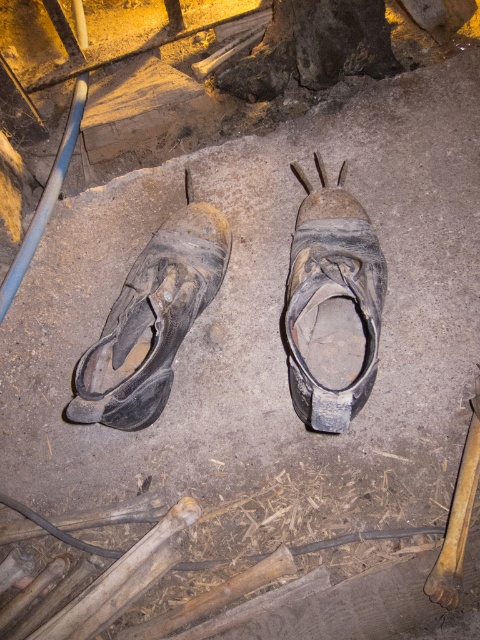
Question: Is worn leather sandal at center positioned in front of worn leather shoe at left?

Choices:
 (A) yes
 (B) no

Answer: (A)

Question: Which object is closer to the camera taking this photo?

Choices:
 (A) worn leather shoe at left
 (B) worn leather sandal at center

Answer: (B)

Question: Considering the relative positions of worn leather sandal at center and worn leather shoe at left in the image provided, where is worn leather sandal at center located with respect to worn leather shoe at left?

Choices:
 (A) right
 (B) left

Answer: (A)

Question: Is worn leather sandal at center below worn leather shoe at left?

Choices:
 (A) no
 (B) yes

Answer: (A)